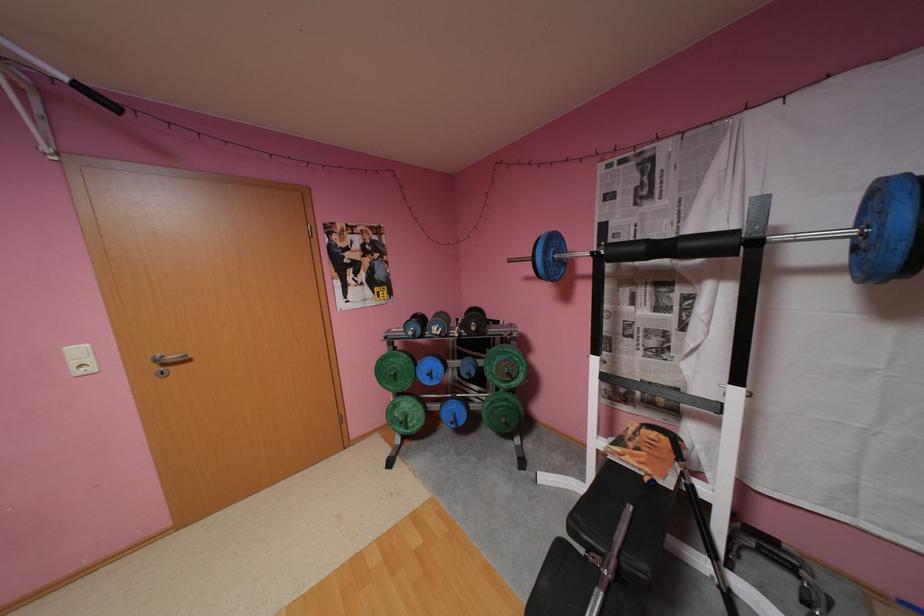
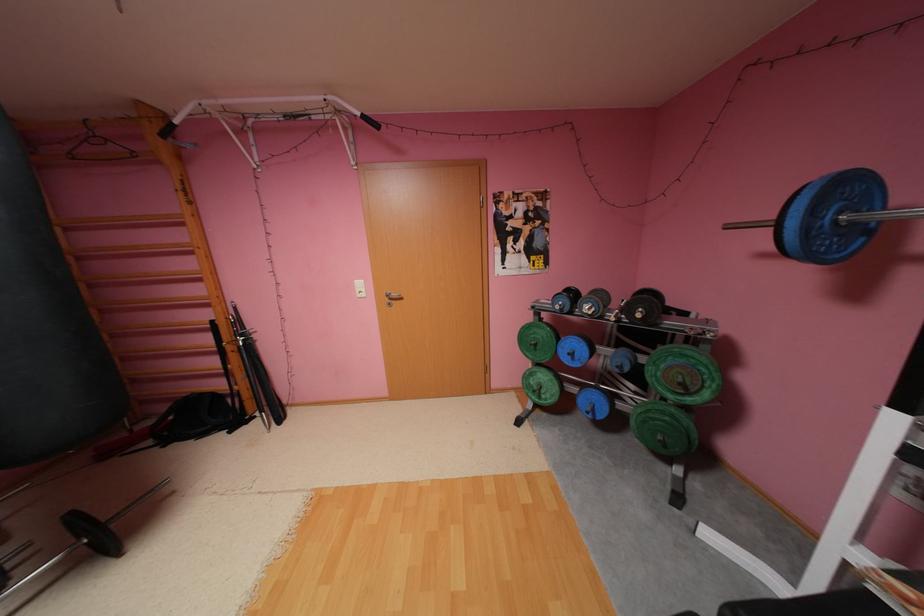
In the second image, find the point that corresponds to [563,241] in the first image.

(855, 188)